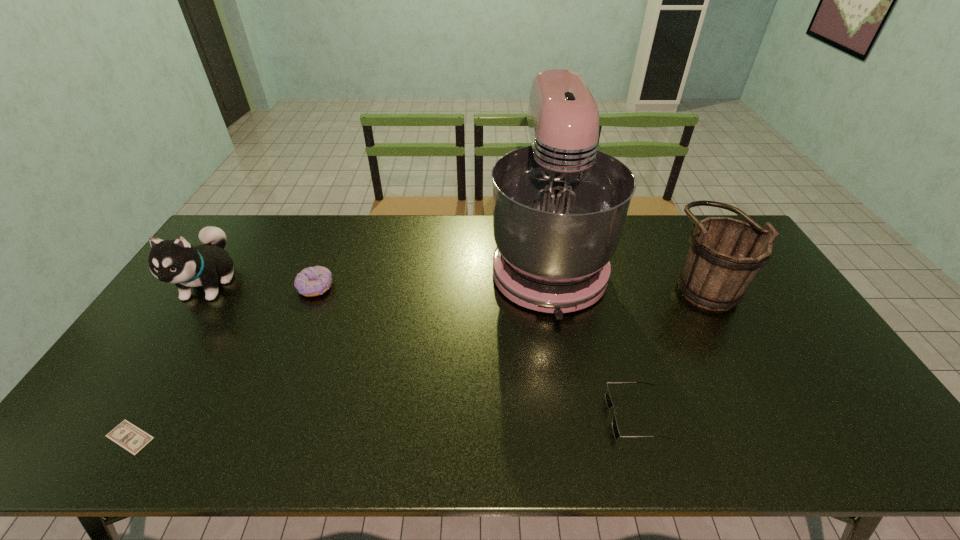
The width and height of the screenshot is (960, 540). In order to click on free spot at the left edge of the desktop in this screenshot , I will do `click(199, 301)`.

Where is `free space at the right edge of the desktop`? The width and height of the screenshot is (960, 540). free space at the right edge of the desktop is located at coordinates (751, 313).

Identify the location of empty space between the tallest object and the puppy. (378, 273).

Where is `vacant space that is in between the fifth tallest object and the tallest object`? This screenshot has height=540, width=960. vacant space that is in between the fifth tallest object and the tallest object is located at coordinates (591, 340).

Locate an element on the screen. The height and width of the screenshot is (540, 960). free spot between the money and the mixer is located at coordinates coord(339,350).

Find the location of a particular element. This screenshot has height=540, width=960. vacant area between the puppy and the mixer is located at coordinates (378, 273).

Find the location of a particular element. This screenshot has width=960, height=540. free point between the fourth object from right to left and the shortest object is located at coordinates (223, 362).

Locate an element on the screen. This screenshot has height=540, width=960. free space that is in between the fifth tallest object and the third shortest object is located at coordinates (476, 352).

What are the coordinates of `empty location between the money and the puppy` in the screenshot? It's located at (170, 360).

I want to click on unoccupied area between the tallest object and the sunglasses, so click(x=591, y=340).